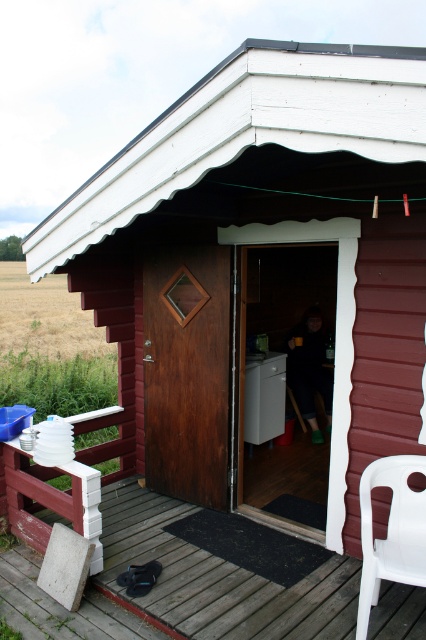
Question: Can you confirm if white plastic chair at lower right is positioned to the left of dark brown leather jacket at center?

Choices:
 (A) no
 (B) yes

Answer: (B)

Question: Estimate the real-world distances between objects in this image. Which object is closer to the white plastic chair at lower right?

Choices:
 (A) wooden deck at lower left
 (B) dark brown leather jacket at center

Answer: (A)

Question: Considering the relative positions of wooden deck at lower left and white plastic chair at lower right in the image provided, where is wooden deck at lower left located with respect to white plastic chair at lower right?

Choices:
 (A) right
 (B) left

Answer: (B)

Question: Which of the following is the farthest from the observer?

Choices:
 (A) wooden deck at lower left
 (B) white plastic chair at lower right

Answer: (A)

Question: Which object is closer to the camera taking this photo?

Choices:
 (A) dark brown leather jacket at center
 (B) wooden deck at lower left
 (C) white plastic chair at lower right

Answer: (C)

Question: Where is wooden deck at lower left located in relation to white plastic chair at lower right in the image?

Choices:
 (A) right
 (B) left

Answer: (B)